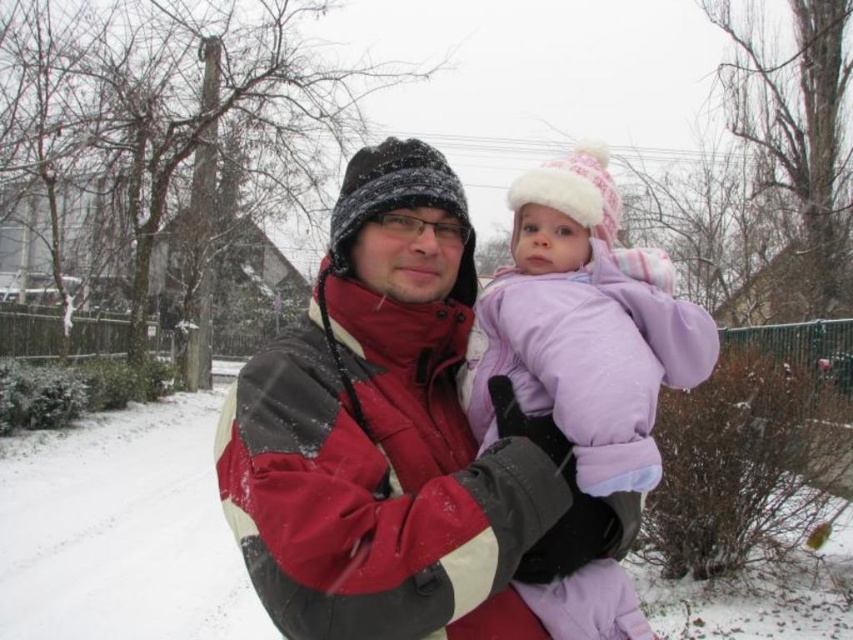
Question: Is the position of matte red jacket at center less distant than that of purple fleece snowsuit at center?

Choices:
 (A) no
 (B) yes

Answer: (B)

Question: Considering the relative positions of matte red jacket at center and purple fleece snowsuit at center in the image provided, where is matte red jacket at center located with respect to purple fleece snowsuit at center?

Choices:
 (A) right
 (B) left

Answer: (B)

Question: Is matte red jacket at center positioned before purple fleece snowsuit at center?

Choices:
 (A) no
 (B) yes

Answer: (B)

Question: Which point appears closest to the camera in this image?

Choices:
 (A) (555, 515)
 (B) (485, 404)

Answer: (A)

Question: Which point is closer to the camera?

Choices:
 (A) (271, 342)
 (B) (564, 316)

Answer: (B)